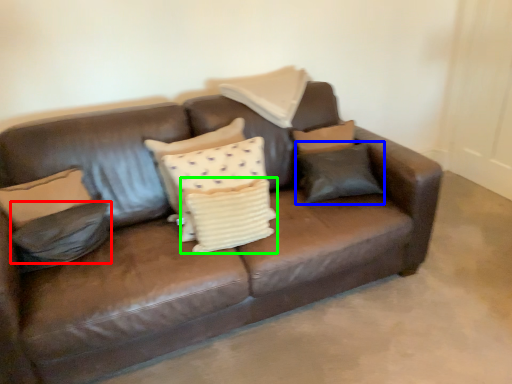
Question: Which is farther away from pillow (highlighted by a red box)? pillow (highlighted by a blue box) or pillow (highlighted by a green box)?

Choices:
 (A) pillow
 (B) pillow

Answer: (A)